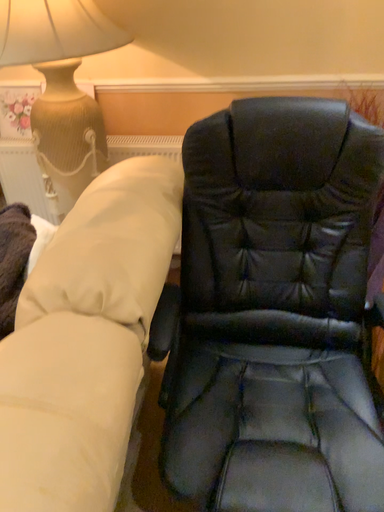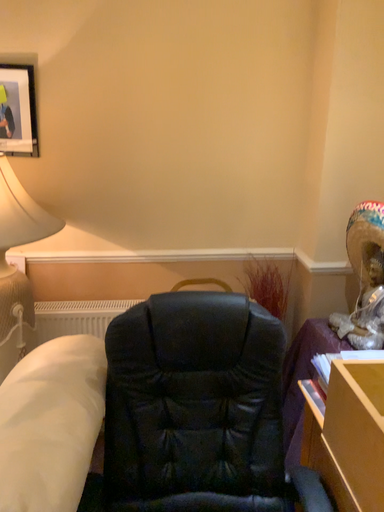
Question: How did the camera likely rotate when shooting the video?

Choices:
 (A) rotated downward
 (B) rotated upward

Answer: (B)